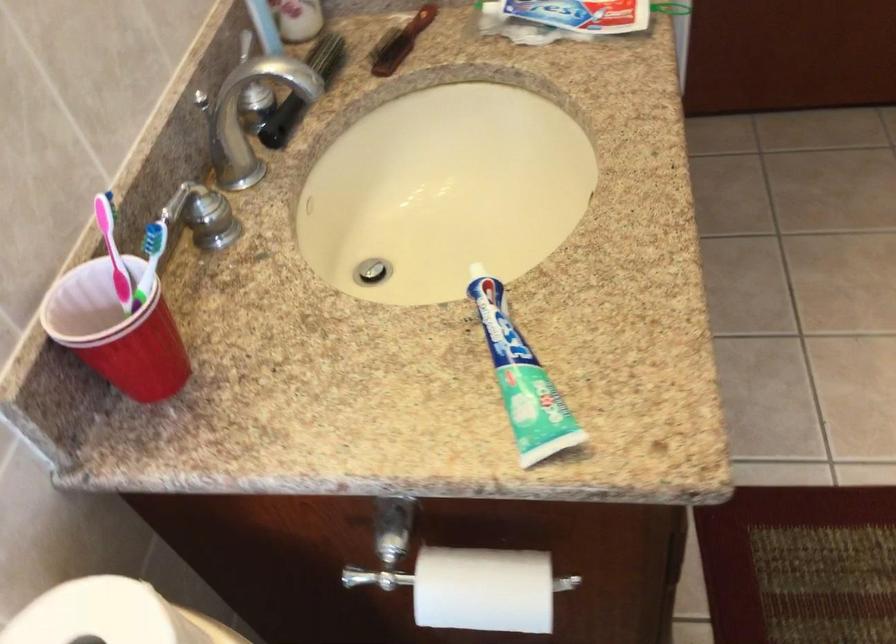
Find where to lift the blue toothbrush. Please return your answer as a coordinate pair (x, y).

(113, 251)